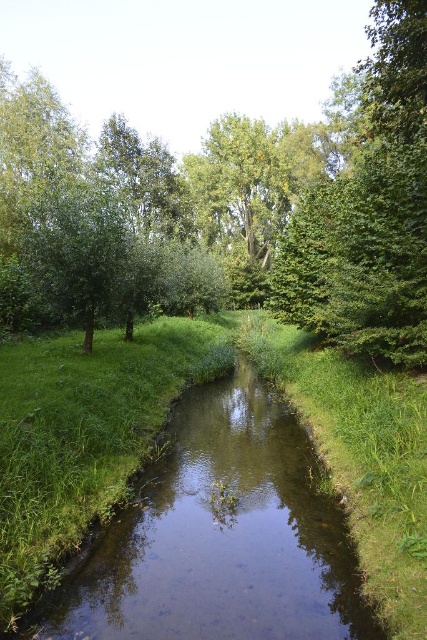
Question: Which of these objects is positioned farthest from the green grassy stream at center?

Choices:
 (A) green leafy tree at center
 (B) green leafy tree at upper right

Answer: (A)

Question: Does green leafy tree at center have a larger size compared to green leafy tree at upper right?

Choices:
 (A) no
 (B) yes

Answer: (B)

Question: Which point appears closest to the camera in this image?

Choices:
 (A) (415, 109)
 (B) (281, 289)

Answer: (A)

Question: Is green leafy tree at center behind green grassy stream at center?

Choices:
 (A) no
 (B) yes

Answer: (B)

Question: Among these objects, which one is nearest to the camera?

Choices:
 (A) green leafy tree at center
 (B) green leafy tree at upper right
 (C) green grassy stream at center

Answer: (C)

Question: Can you confirm if green leafy tree at center is positioned to the left of green grassy stream at center?

Choices:
 (A) no
 (B) yes

Answer: (A)